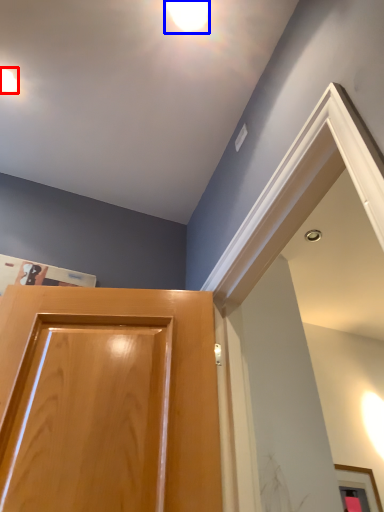
Question: Which object is closer to the camera taking this photo, droplight (highlighted by a red box) or droplight (highlighted by a blue box)?

Choices:
 (A) droplight
 (B) droplight

Answer: (B)